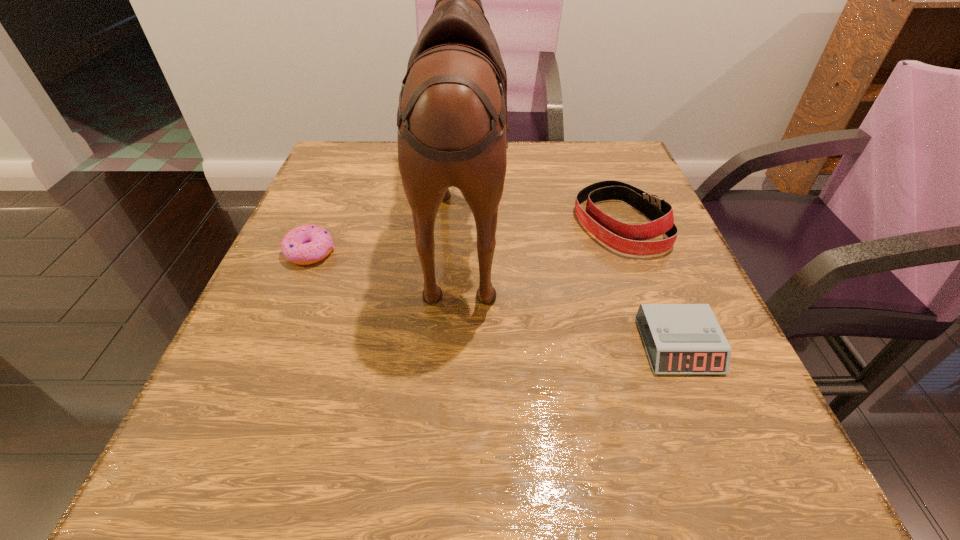
Image resolution: width=960 pixels, height=540 pixels. What are the coordinates of `object that is positioned at the left edge` in the screenshot? It's located at (306, 244).

Locate an element on the screen. This screenshot has height=540, width=960. dog collar at the right edge is located at coordinates (626, 238).

Identify the location of alarm clock located in the right edge section of the desktop. The image size is (960, 540). (683, 338).

Locate an element on the screen. free space at the far edge of the desktop is located at coordinates (532, 182).

Where is `free space at the near edge of the desktop`? The width and height of the screenshot is (960, 540). free space at the near edge of the desktop is located at coordinates (655, 468).

Locate an element on the screen. The image size is (960, 540). vacant area at the left edge is located at coordinates (297, 418).

The height and width of the screenshot is (540, 960). What are the coordinates of `vacant space at the right edge of the desktop` in the screenshot? It's located at (596, 244).

Where is `vacant space at the far left corner of the desktop`? This screenshot has height=540, width=960. vacant space at the far left corner of the desktop is located at coordinates pos(380,192).

Where is `vacant space at the far right corner of the desktop`? vacant space at the far right corner of the desktop is located at coordinates (629, 182).

You are a GUI agent. You are given a task and a screenshot of the screen. Output one action in this format:
    pyautogui.click(x=<x>, y=<y>)
    Task: Click on the unoccupied position between the second object from left to right and the second tallest object
    This screenshot has width=960, height=540.
    Given the screenshot: What is the action you would take?
    pyautogui.click(x=541, y=221)